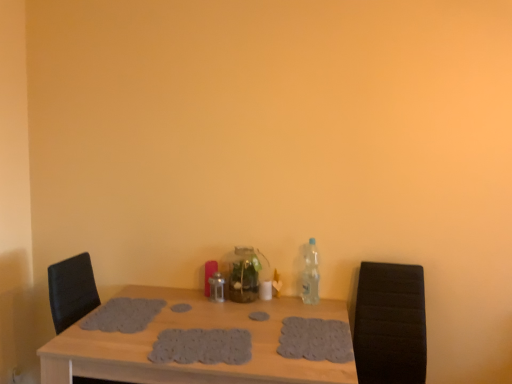
This screenshot has width=512, height=384. In order to click on vacant space to the left of gray fabric placemat at center, the 3th footprint in the left-to-right sequence in this screenshot , I will do click(225, 317).